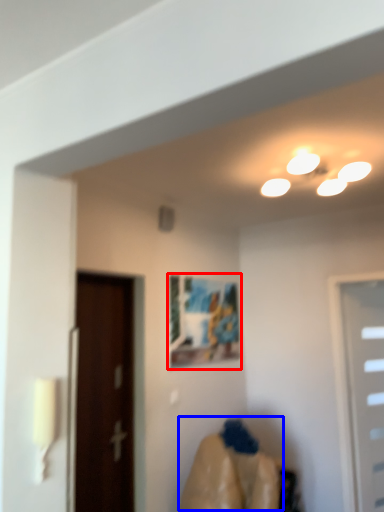
Question: Which of the following is the closest to the observer, picture frame (highlighted by a red box) or woman (highlighted by a blue box)?

Choices:
 (A) picture frame
 (B) woman

Answer: (B)